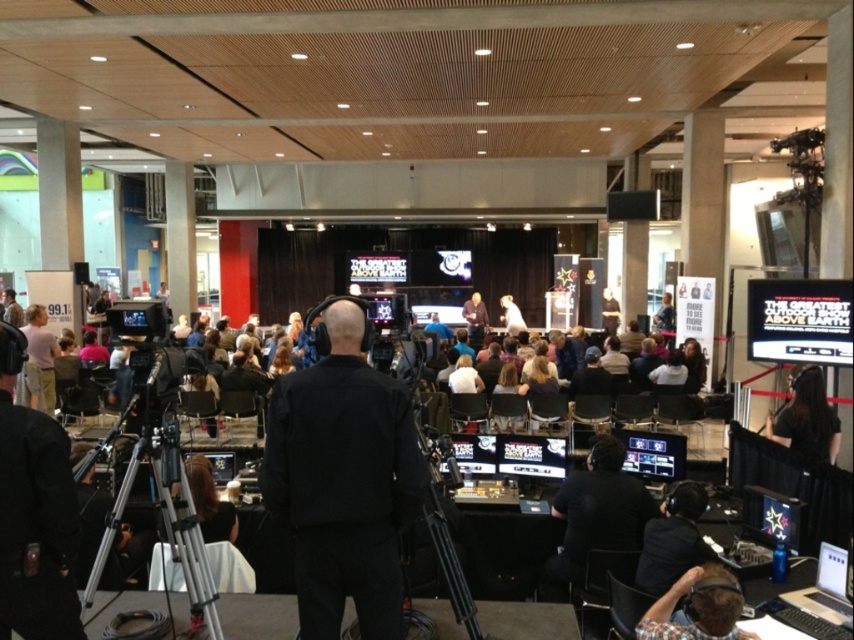
You are attending an event in the conference hall and notice two people in the production area. One is wearing a black matte jacket at center and the other has a plaid shirt at lower right. Which person is positioned closer to the front of the production area?

The black matte jacket at center is closer to the viewer than the plaid shirt at lower right, so the person in the black matte jacket at center is positioned closer to the front of the production area.

You are an event technician who needs to adjust the focus of the black matte camera at left and the black hair at center. Which object should you adjust first if you want to start with the one closer to you?

The black matte camera at left is closer to the viewer than the black hair at center, so you should adjust the focus of the black matte camera at left first.